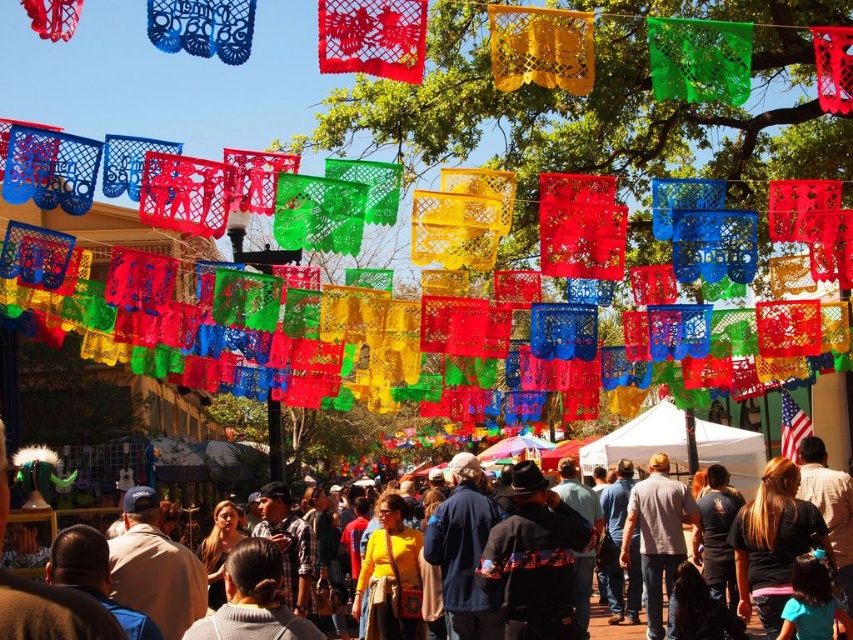
Does yellow fabric purse at center appear over light gray cotton shirt at center?

Correct, yellow fabric purse at center is located above light gray cotton shirt at center.

Which is below, yellow fabric purse at center or light gray cotton shirt at center?

Positioned lower is light gray cotton shirt at center.

Between point (28, 627) and point (653, 492), which one is positioned in front?

Positioned in front is point (28, 627).

Identify the location of yellow fabric purse at center. This screenshot has width=853, height=640. (51, 612).